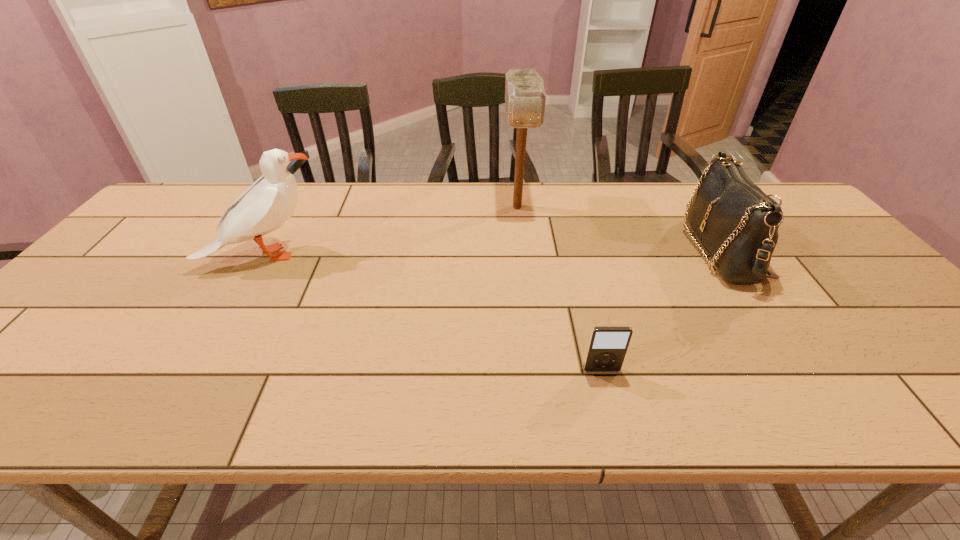
Identify the location of vacant area that lies between the shortest object and the handbag. (660, 310).

In order to click on free space between the leftmost object and the nearest object in this screenshot , I will do `click(434, 312)`.

The width and height of the screenshot is (960, 540). In order to click on free space between the second object from left to right and the shortest object in this screenshot , I will do pyautogui.click(x=560, y=288).

The width and height of the screenshot is (960, 540). Identify the location of free spot between the second object from right to left and the rightmost object. (660, 310).

Identify the location of blank region between the iPod and the handbag. The width and height of the screenshot is (960, 540). (660, 310).

This screenshot has width=960, height=540. Find the location of `vacant region between the leftmost object and the nearest object`. vacant region between the leftmost object and the nearest object is located at coordinates (434, 312).

Identify the location of vacant space that's between the third tallest object and the shortest object. pyautogui.click(x=660, y=310).

Identify the location of vacant area that lies between the third tallest object and the second object from left to right. Image resolution: width=960 pixels, height=540 pixels. [618, 228].

Locate an element on the screen. This screenshot has height=540, width=960. object that is the second nearest to the leftmost object is located at coordinates (607, 347).

Identify the location of object that stands as the closest to the gull. (525, 99).